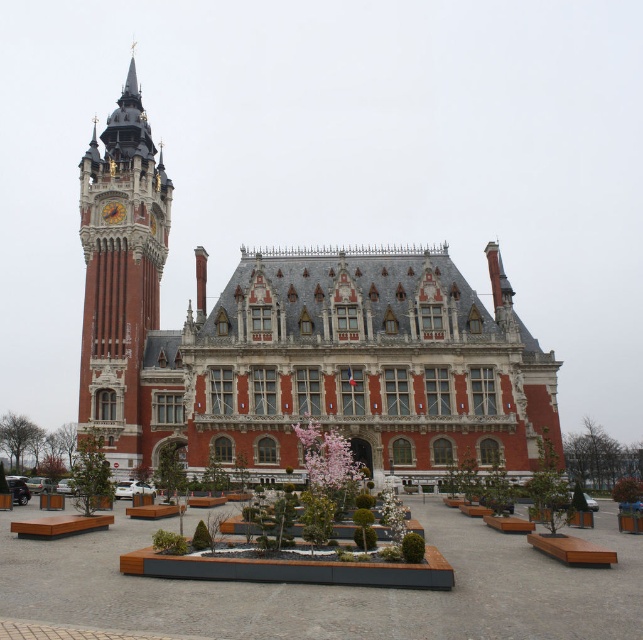
Between red brick clock tower at left and gold metallic clock at upper left, which one has more height?

red brick clock tower at left

Can you confirm if red brick clock tower at left is wider than gold metallic clock at upper left?

Indeed, red brick clock tower at left has a greater width compared to gold metallic clock at upper left.

In order to click on red brick clock tower at left in this screenshot , I will do `click(120, 275)`.

Which is behind, point (476, 392) or point (194, 621)?

Positioned behind is point (476, 392).

Is red brick palace at center below wooden bench at center?

Incorrect, red brick palace at center is not positioned below wooden bench at center.

Locate an element on the screen. The width and height of the screenshot is (643, 640). red brick palace at center is located at coordinates (294, 344).

The height and width of the screenshot is (640, 643). What do you see at coordinates (331, 588) in the screenshot?
I see `wooden bench at center` at bounding box center [331, 588].

Which is more to the left, wooden bench at center or red brick clock tower at left?

red brick clock tower at left

Is point (311, 604) positioned before point (141, 259)?

Yes.

Find the location of a particular element. Image resolution: width=643 pixels, height=640 pixels. wooden bench at center is located at coordinates (331, 588).